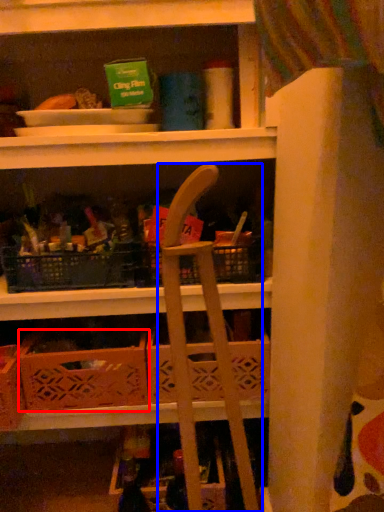
Question: Which of the following is the closest to the observer, crate (highlighted by a red box) or folding chair (highlighted by a blue box)?

Choices:
 (A) crate
 (B) folding chair

Answer: (B)